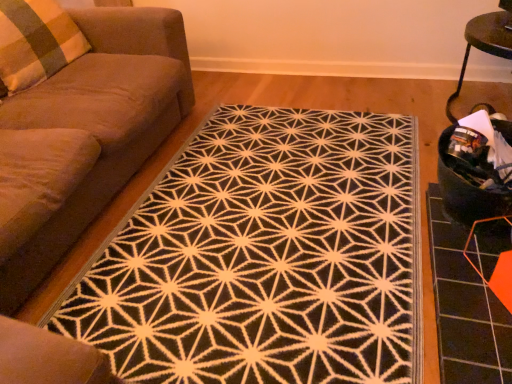
Question: From the image's perspective, is black fabric swivel chair at right located above or below suede-like brown couch at left?

Choices:
 (A) above
 (B) below

Answer: (B)

Question: From a real-world perspective, relative to suede-like brown couch at left, is black fabric swivel chair at right vertically above or below?

Choices:
 (A) below
 (B) above

Answer: (A)

Question: Which object is positioned farthest from the suede-like brown couch at left?

Choices:
 (A) black textured rug at center
 (B) plaid fabric pillow at left
 (C) orange hexagonal tile at lower right
 (D) black fabric swivel chair at right

Answer: (C)

Question: Considering the real-world distances, which object is closest to the black fabric swivel chair at right?

Choices:
 (A) suede-like brown couch at left
 (B) plaid fabric pillow at left
 (C) black textured rug at center
 (D) orange hexagonal tile at lower right

Answer: (D)